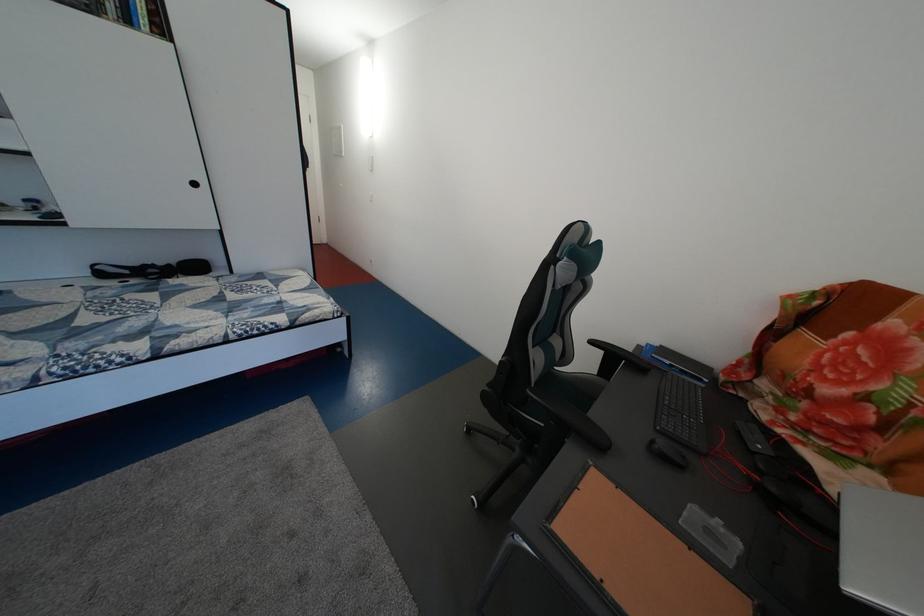
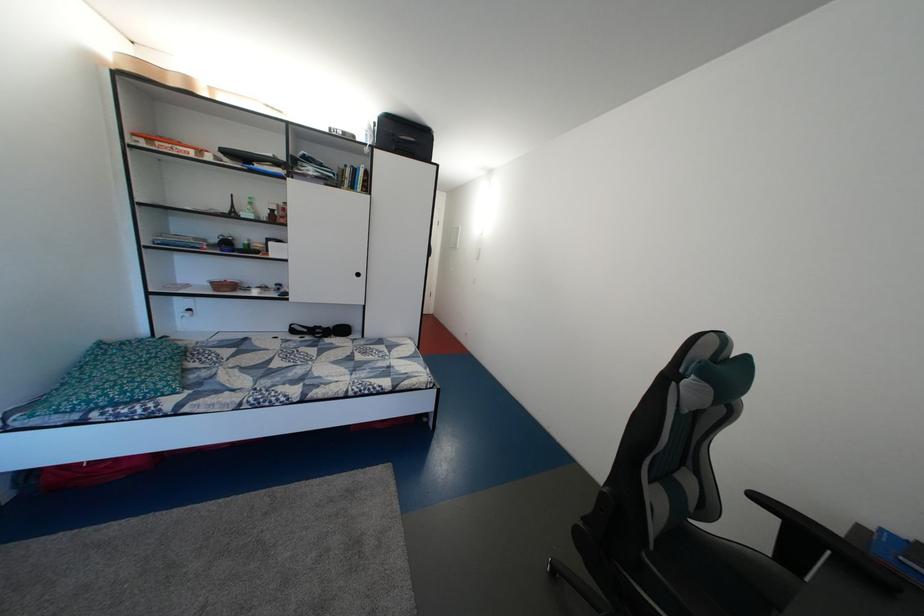
Where in the second image is the point corresponding to point (257, 323) from the first image?

(373, 382)